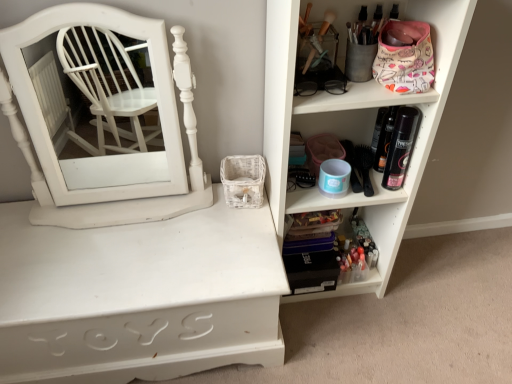
Image resolution: width=512 pixels, height=384 pixels. Find the location of `free space in front of white wood medicine cabinet at left`. free space in front of white wood medicine cabinet at left is located at coordinates (108, 258).